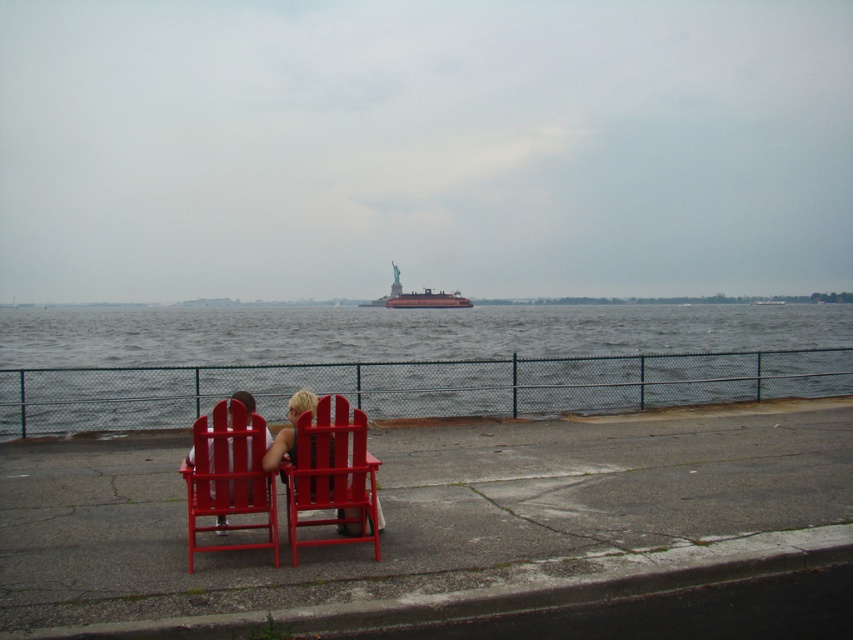
Who is lower down, smooth glossy wood chair at center or matte wood chairs at center?

smooth glossy wood chair at center is lower down.

Is smooth glossy wood chair at center bigger than matte wood chairs at center?

Yes.

Describe the element at coordinates (229, 476) in the screenshot. The image size is (853, 640). I see `smooth glossy wood chair at center` at that location.

The image size is (853, 640). What are the coordinates of `smooth glossy wood chair at center` in the screenshot? It's located at (229, 476).

Is matte wood chair at center smaller than matte wood chairs at center?

Actually, matte wood chair at center might be larger than matte wood chairs at center.

Measure the distance between matte wood chair at center and matte wood chairs at center.

matte wood chair at center is 18.64 inches from matte wood chairs at center.

Between point (364, 436) and point (267, 468), which one is positioned behind?

Point (267, 468)

Where is `matte wood chair at center`? matte wood chair at center is located at coordinates (329, 472).

Which is in front, point (393, 296) or point (287, 448)?

Point (287, 448)

Who is higher up, metallic gray ferry at center or matte wood chairs at center?

metallic gray ferry at center

At what (x,y) coordinates should I click in order to perform the action: click on metallic gray ferry at center. Please return your answer as a coordinate pair (x, y). Looking at the image, I should click on (418, 298).